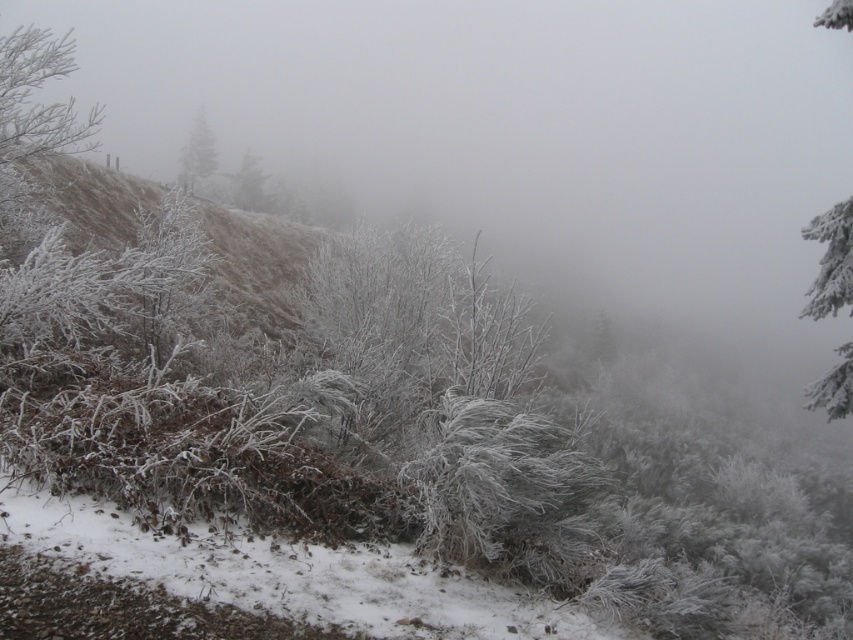
You are standing in the wintry landscape and want to walk from the point closer to you to the point further away. Which path would you take between point (x=833, y=1) and point (x=252, y=163)?

You should walk from point (x=833, y=1) to point (x=252, y=163) because point (x=833, y=1) is closer to the viewer and you want to move to the point further away.

You are navigating through the wintry landscape and need to reach a destination located at point (187,168). There is an obstacle at point (824,282). Will you encounter the obstacle before reaching your destination?

Yes, you will encounter the obstacle at point (824,282) before reaching your destination at point (187,168) because point (824,282) is in front of point (187,168).

You are standing at the point marked as point (196,154) in the image. What object is exactly at your current location?

The snowcovered evergreen tree at upper center is located at point (196,154).